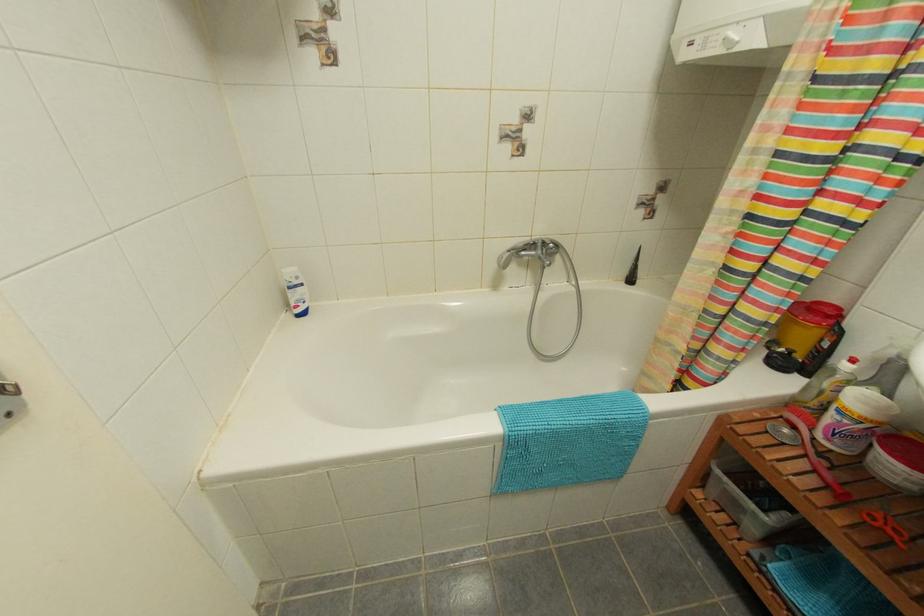
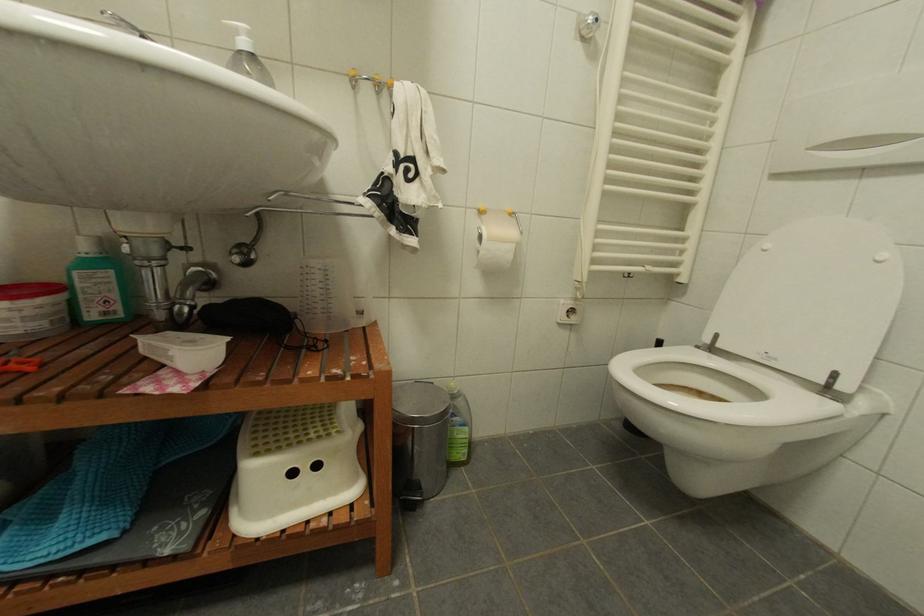
The images are taken continuously from a first-person perspective. In which direction is your viewpoint rotating?

The rotation direction of the camera is right-down.